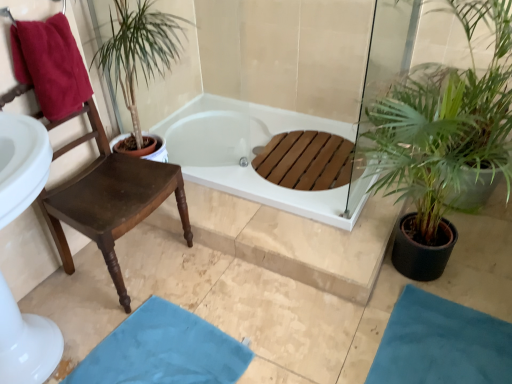
Question: Considering the positions of point (136, 377) and point (188, 142), is point (136, 377) closer or farther from the camera than point (188, 142)?

Choices:
 (A) closer
 (B) farther

Answer: (A)

Question: From the image's perspective, is blue fabric bath mat at lower center, which is counted as the 2th bath mat, starting from the right, positioned above or below white glossy bathtub at center?

Choices:
 (A) above
 (B) below

Answer: (B)

Question: Estimate the real-world distances between objects in this image. Which object is closer to the blue fabric bath mat at lower center, which is counted as the 2th bath mat, starting from the right?

Choices:
 (A) white glossy bathtub at center
 (B) maroon cotton towel at left
 (C) green leafy plant at right
 (D) brown wood chair at left
 (E) blue fabric bath mat at lower right, which appears as the first bath mat when viewed from the right

Answer: (D)

Question: Based on their relative distances, which object is nearer to the brown wood chair at left?

Choices:
 (A) green leafy plant at right
 (B) maroon cotton towel at left
 (C) white glossy bathtub at center
 (D) blue fabric bath mat at lower right, which appears as the first bath mat when viewed from the right
 (E) blue fabric bath mat at lower center, placed as the first bath mat when sorted from left to right

Answer: (B)